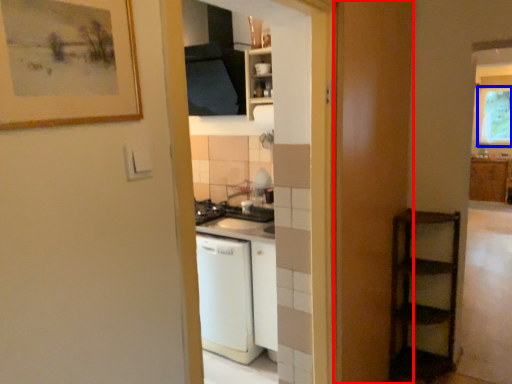
Question: Which object is closer to the camera taking this photo, screen door (highlighted by a red box) or window (highlighted by a blue box)?

Choices:
 (A) screen door
 (B) window

Answer: (A)